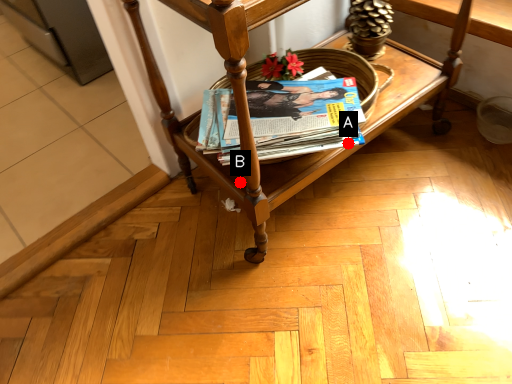
Question: Two points are circled on the image, labeled by A and B beside each circle. Among these points, which one is nearest to the camera?

Choices:
 (A) A is closer
 (B) B is closer

Answer: (A)